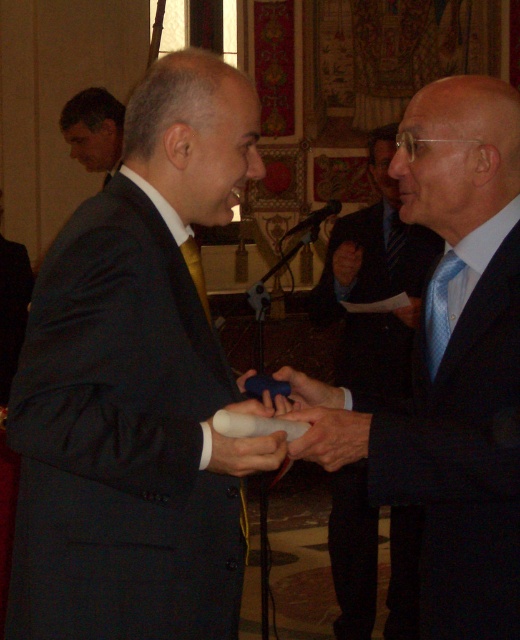
You are standing in the same room as the two men and want to move from the point marked at (82, 467) to the point marked at (438, 276). Which direction should you move to reach your destination?

To move from point (82, 467) to point (438, 276), you should move backward since point (82, 467) is in front of point (438, 276).

You are an event photographer at the ceremony. You need to capture a photo where both the matte black suit at upper left and the blue rubber glove at center are visible. Based on their positions, which object should be placed on the left side of the photo frame?

The matte black suit at upper left should be placed on the left side of the photo frame because it is positioned to the left of the blue rubber glove at center.

You are a photographer taking a portrait of the blue silk tie at right and the smooth leather hand at center. Which object should you focus on first to ensure both are in sharp focus?

The blue silk tie at right is closer to the viewer than the smooth leather hand at center, so focus on the blue silk tie at right first to ensure both are in sharp focus.